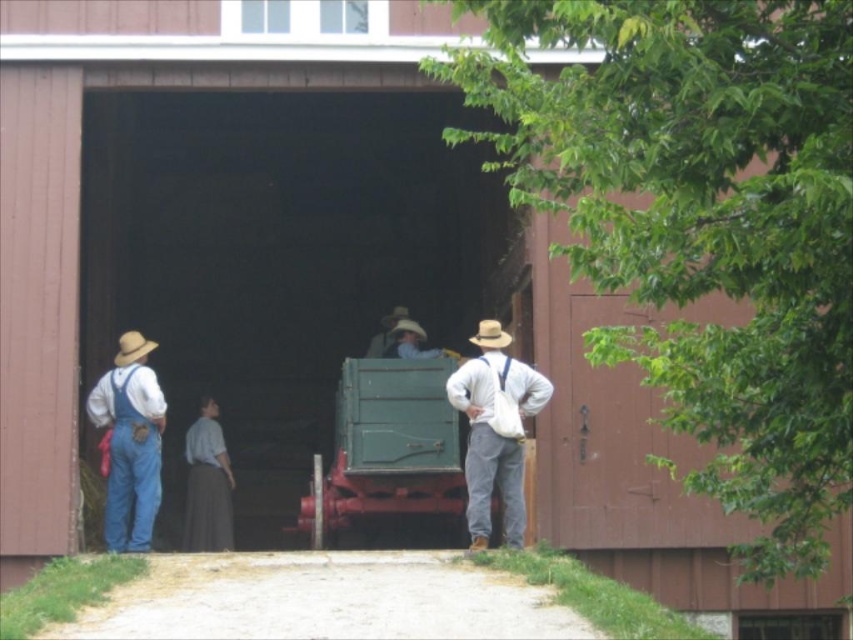
Which is in front, point (138, 522) or point (492, 330)?

Point (492, 330) is in front.

Is denim overalls at left below light brown felt cowboy hat at center?

Yes, denim overalls at left is below light brown felt cowboy hat at center.

The height and width of the screenshot is (640, 853). What do you see at coordinates (131, 442) in the screenshot?
I see `denim overalls at left` at bounding box center [131, 442].

The height and width of the screenshot is (640, 853). Identify the location of denim overalls at left. click(131, 442).

Can you confirm if green matte wagon at center is smaller than denim overalls at left?

No, green matte wagon at center is not smaller than denim overalls at left.

Does green matte wagon at center lie in front of denim overalls at left?

No, it is behind denim overalls at left.

Which is behind, point (393, 424) or point (152, 371)?

The point (152, 371) is more distant.

Where is `green matte wagon at center`? green matte wagon at center is located at coordinates (387, 445).

Can you confirm if light blue shirt at center is positioned above light brown leather hat at center?

Incorrect, light blue shirt at center is not positioned above light brown leather hat at center.

Which of these two, light blue shirt at center or light brown leather hat at center, stands taller?

light blue shirt at center is taller.

Identify the location of light blue shirt at center. click(207, 484).